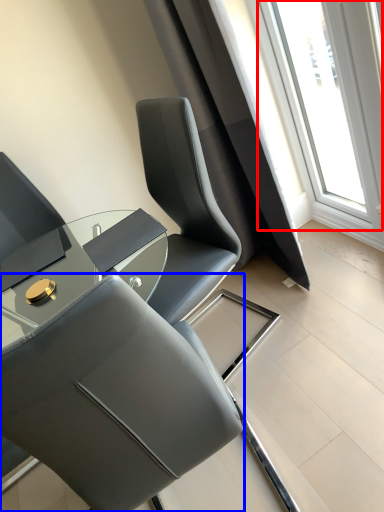
Question: Which point is closer to the camera, window (highlighted by a red box) or chair (highlighted by a blue box)?

Choices:
 (A) window
 (B) chair

Answer: (B)